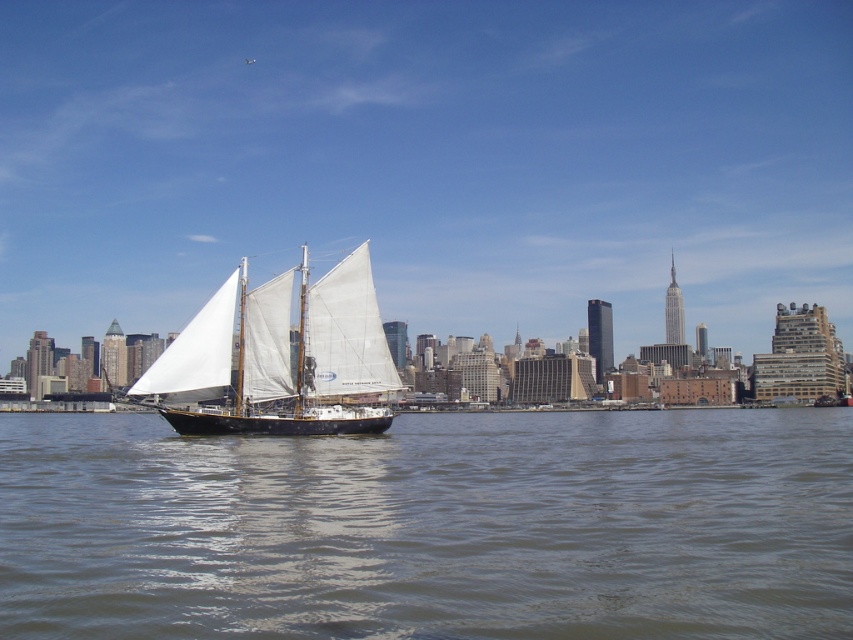
Question: Can you confirm if brown water at center is positioned above white matte sailboat at center?

Choices:
 (A) yes
 (B) no

Answer: (B)

Question: Is brown water at center below white matte sailboat at center?

Choices:
 (A) no
 (B) yes

Answer: (B)

Question: Can you confirm if brown water at center is positioned to the left of white matte sailboat at center?

Choices:
 (A) no
 (B) yes

Answer: (A)